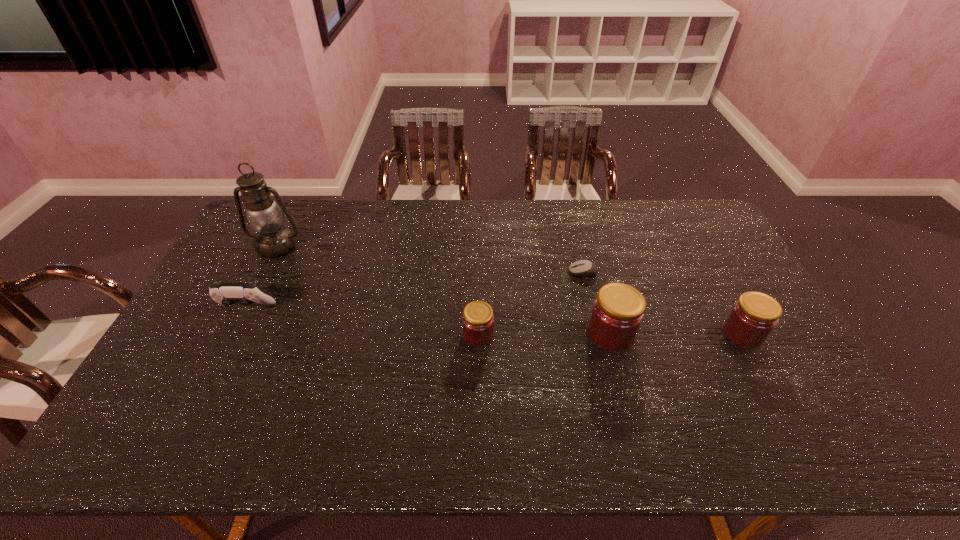
Locate an element on the screen. The height and width of the screenshot is (540, 960). the second closest object to the tallest object is located at coordinates point(478,320).

Image resolution: width=960 pixels, height=540 pixels. Identify the location of jam that is the second closest to the fifth shortest object. (478, 320).

Where is `the second closest jam relative to the fourth object from right to left`? the second closest jam relative to the fourth object from right to left is located at coordinates (753, 317).

The height and width of the screenshot is (540, 960). I want to click on vacant area that satisfies the following two spatial constraints: 1. on the front-facing side of the control; 2. on the right side of the fifth shortest object, so click(233, 334).

You are a GUI agent. You are given a task and a screenshot of the screen. Output one action in this format:
    pyautogui.click(x=<x>, y=<y>)
    Task: Click on the free region that satisfies the following two spatial constraints: 1. on the wheel side of the second farthest object; 2. on the front-facing side of the control
    This screenshot has height=540, width=960.
    Given the screenshot: What is the action you would take?
    pyautogui.click(x=592, y=308)

At what (x,y) coordinates should I click in order to perform the action: click on vacant space that satisfies the following two spatial constraints: 1. on the front-facing side of the control; 2. on the left side of the tallest jam. Please return your answer as a coordinate pair (x, y). Looking at the image, I should click on (233, 334).

I want to click on free point that satisfies the following two spatial constraints: 1. on the front side of the tallest object; 2. on the left side of the second tallest object, so click(231, 334).

Locate an element on the screen. This screenshot has height=540, width=960. free space that satisfies the following two spatial constraints: 1. on the wheel side of the second jam from left to right; 2. on the right side of the second farthest object is located at coordinates [x=598, y=334].

You are a GUI agent. You are given a task and a screenshot of the screen. Output one action in this format:
    pyautogui.click(x=<x>, y=<y>)
    Task: Click on the free space that satisfies the following two spatial constraints: 1. on the wheel side of the second farthest object; 2. on the front-facing side of the control
    
    Given the screenshot: What is the action you would take?
    pyautogui.click(x=592, y=308)

You are a GUI agent. You are given a task and a screenshot of the screen. Output one action in this format:
    pyautogui.click(x=<x>, y=<y>)
    Task: Click on the free spot that satisfies the following two spatial constraints: 1. on the wheel side of the fifth nearest object; 2. on the back side of the second shortest jam
    The image size is (960, 540).
    Given the screenshot: What is the action you would take?
    pyautogui.click(x=598, y=334)